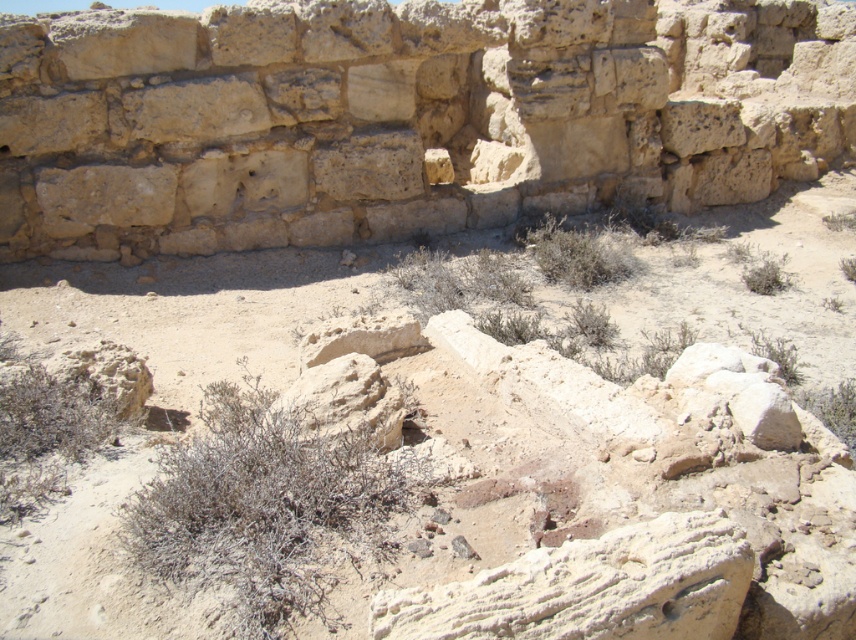
Question: Which object is farther from the camera taking this photo?

Choices:
 (A) beige stone wall at upper center
 (B) green shrub at center
 (C) smooth beige rock at center

Answer: (A)

Question: Which point is farther from the camera taking this photo?

Choices:
 (A) (205, 621)
 (B) (571, 246)

Answer: (B)

Question: Which point is farther from the camera taking this photo?

Choices:
 (A) (125, 164)
 (B) (94, 609)
 (C) (381, 403)
 (D) (330, 474)

Answer: (A)

Question: Is dry shrub at center further to camera compared to green shrub at center?

Choices:
 (A) yes
 (B) no

Answer: (B)

Question: Does beige stone wall at upper center appear on the right side of rough textured stone at center?

Choices:
 (A) yes
 (B) no

Answer: (A)

Question: Can you confirm if desert sand at center is positioned to the left of smooth beige rock at center?

Choices:
 (A) no
 (B) yes

Answer: (B)